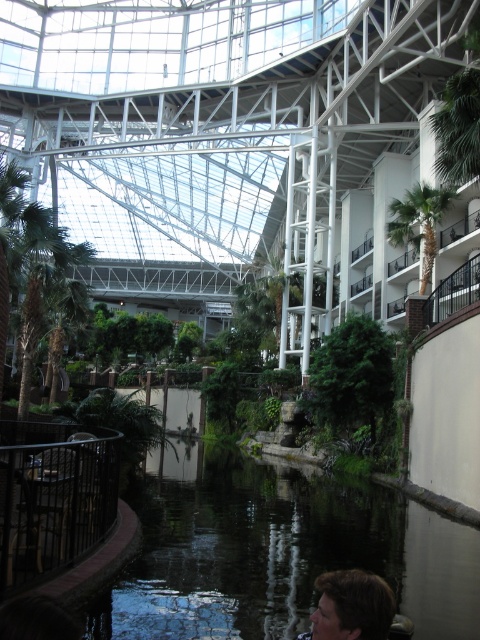
You are standing at the entrance of the atrium and want to reach the smooth concrete pond at center. According to the map coordinates provided, what are the coordinates you need to navigate to?

The smooth concrete pond at center is located at point (277, 552), so you should navigate to those coordinates to reach it.

You are standing in the atrium and want to get to the seating area behind the green leafy palm tree at upper right. Can you walk directly behind the smooth concrete pond at center to reach it?

The smooth concrete pond at center is in front of the green leafy palm tree at upper right, so walking behind the smooth concrete pond at center would allow you to reach the seating area behind the green leafy palm tree at upper right.